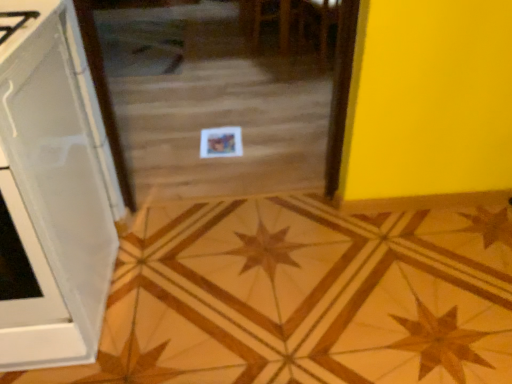
Question: Is wooden star at center inside the boundaries of white glossy cabinet at left, or outside?

Choices:
 (A) outside
 (B) inside

Answer: (A)

Question: Considering the positions of wooden star at center and white glossy cabinet at left in the image, is wooden star at center wider or thinner than white glossy cabinet at left?

Choices:
 (A) wide
 (B) thin

Answer: (A)

Question: Which is farther from the wooden star at center?

Choices:
 (A) transparent glass door at center
 (B) white glossy cabinet at left

Answer: (A)

Question: Which object is the farthest from the white glossy cabinet at left?

Choices:
 (A) wooden star at center
 (B) transparent glass door at center

Answer: (B)